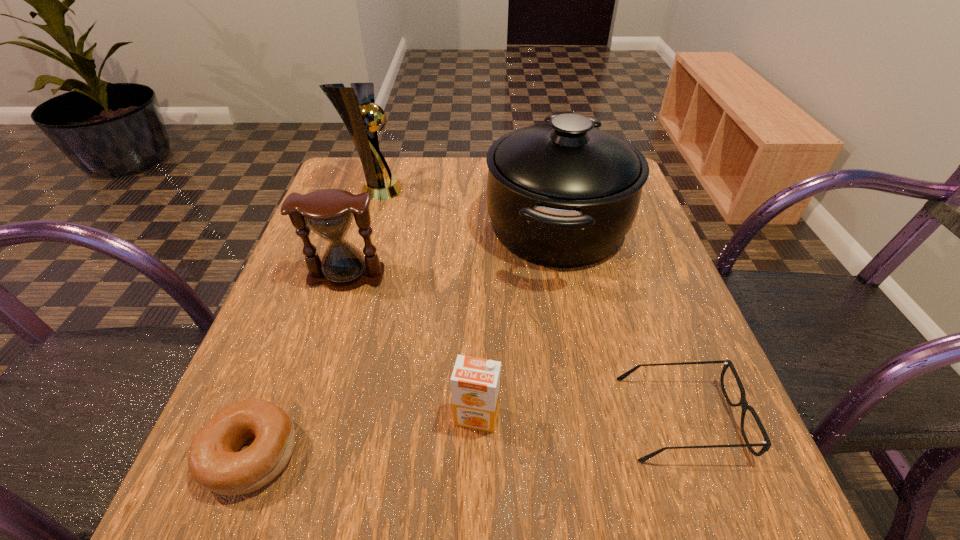
Locate an element on the screen. The image size is (960, 540). award is located at coordinates (356, 106).

Image resolution: width=960 pixels, height=540 pixels. In order to click on the second tallest object in this screenshot , I will do `click(563, 195)`.

In order to click on the fourth shortest object in this screenshot , I will do `click(329, 213)`.

I want to click on the fourth tallest object, so click(x=475, y=382).

Identify the location of bagel. (214, 462).

I want to click on spectacles, so click(x=766, y=444).

This screenshot has width=960, height=540. In order to click on vacant area situated 0.130m at the front of the award, where the globe is visible in this screenshot , I will do `click(454, 190)`.

Where is `free region located 0.200m on the left of the saucepan`? The height and width of the screenshot is (540, 960). free region located 0.200m on the left of the saucepan is located at coordinates (397, 226).

Where is `vacant area located on the back of the third tallest object`? vacant area located on the back of the third tallest object is located at coordinates (366, 215).

Image resolution: width=960 pixels, height=540 pixels. I want to click on vacant area situated 0.240m on the left of the orange juice, so click(295, 416).